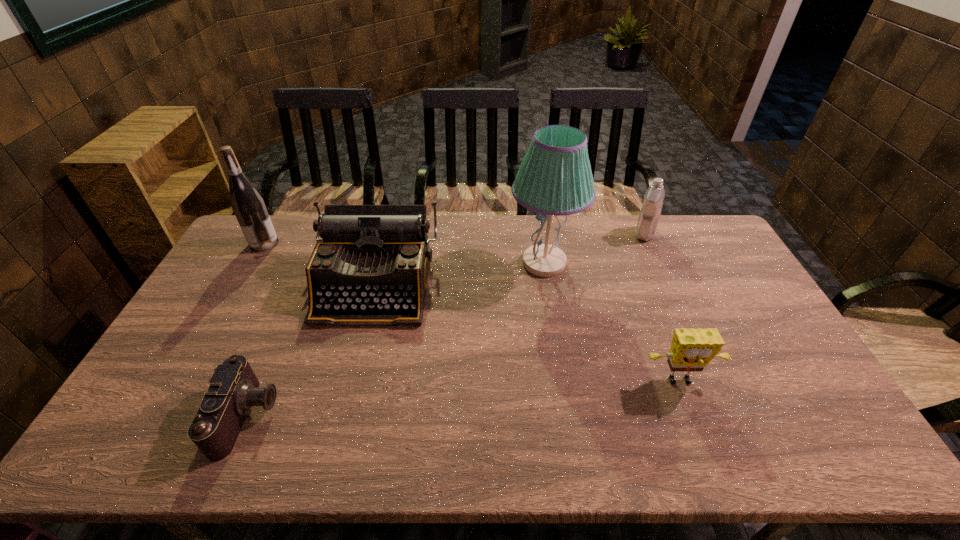
Find the location of a particular element. the tallest object is located at coordinates (555, 178).

Locate an element on the screen. The image size is (960, 540). lamp is located at coordinates (555, 178).

Locate an element on the screen. wine bottle is located at coordinates (249, 208).

At what (x,y) coordinates should I click in order to perform the action: click on the fifth shortest object. Please return your answer as a coordinate pair (x, y). This screenshot has height=540, width=960. Looking at the image, I should click on (249, 208).

Where is `detergent`? The width and height of the screenshot is (960, 540). detergent is located at coordinates (649, 216).

I want to click on typewriter, so click(371, 266).

Find the location of a particular element. This screenshot has height=540, width=960. sponge is located at coordinates (691, 349).

The width and height of the screenshot is (960, 540). In order to click on the shortest object in this screenshot , I will do `click(233, 389)`.

The width and height of the screenshot is (960, 540). Identify the location of vacant space situated on the left of the tallest object. (470, 263).

The width and height of the screenshot is (960, 540). I want to click on free spot located 0.390m on the front of the wine bottle, so click(x=210, y=338).